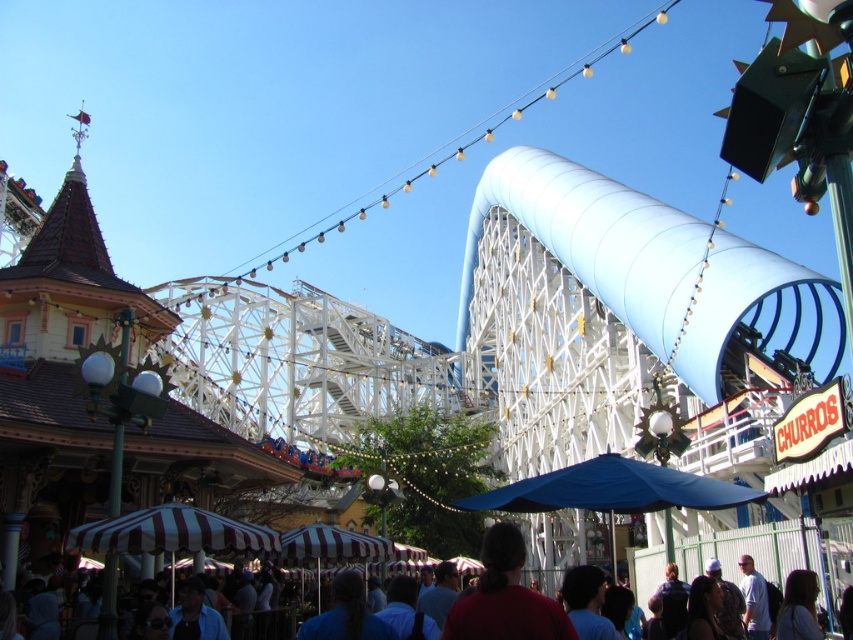
You are planning to set up a new food stall at the fairground. You want to place it equidistant from both the blue striped umbrella at lower center and the red matte shirt at center. What is the minimum distance you need to maintain from each of these two points to ensure equal distance?

The minimum distance you need to maintain from each of the blue striped umbrella at lower center and the red matte shirt at center is half of the distance between them, which is approximately 14.98 meters.

You are standing at the fairground and want to locate two specific points marked in the image. The first point is at coordinate point(773, 557) and the second is at point(538, 618). Which point is closer to your current position?

Point(773, 557) is closer to your current position because it is further to the viewer than point(538, 618).

You are a visitor at the fairground and want to take a photo of the roller coaster with both the blue striped umbrella at lower center and the red matte shirt at center in the background. Which object should you position closer to the camera to ensure both are in frame?

The blue striped umbrella at lower center is much taller than the red matte shirt at center, so you should position the blue striped umbrella at lower center closer to the camera to ensure both objects are visible in the frame.